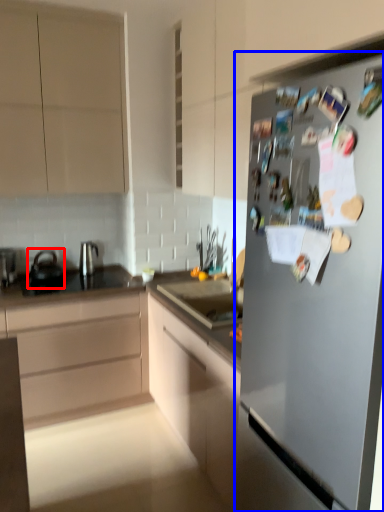
Question: Which of the following is the closest to the observer, tea pot (highlighted by a red box) or refrigerator (highlighted by a blue box)?

Choices:
 (A) tea pot
 (B) refrigerator

Answer: (B)